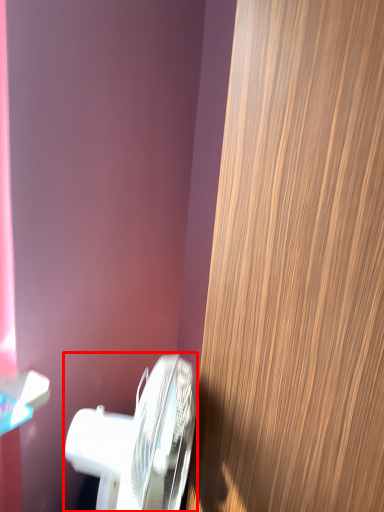
Question: Observing the image, what is the correct spatial positioning of toilet (annotated by the red box) in reference to door?

Choices:
 (A) left
 (B) right

Answer: (A)